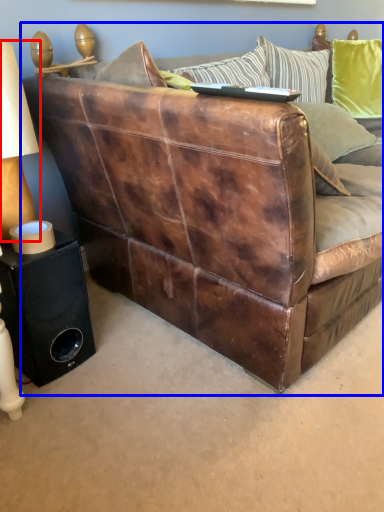
Question: Which point is closer to the camera, table lamp (highlighted by a red box) or studio couch (highlighted by a blue box)?

Choices:
 (A) table lamp
 (B) studio couch

Answer: (B)